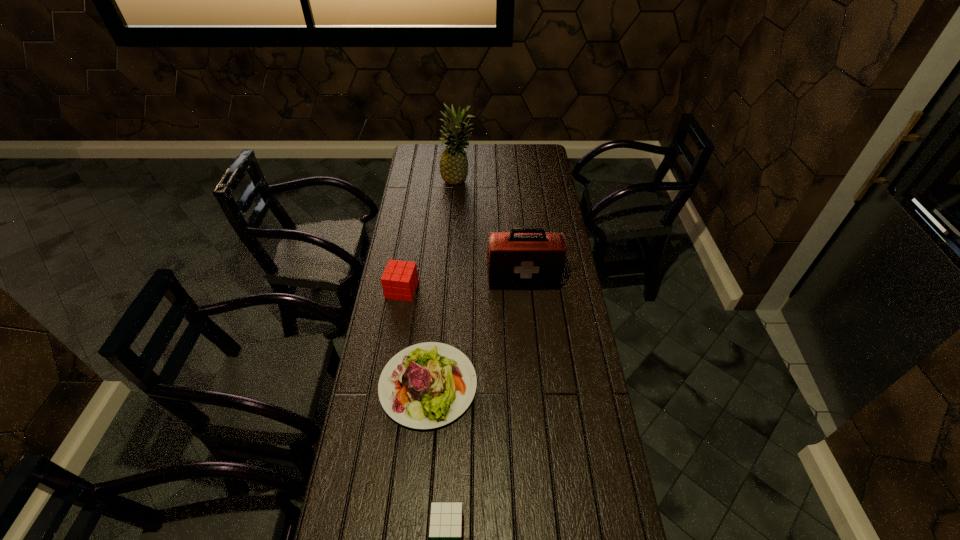
The height and width of the screenshot is (540, 960). In order to click on empty space between the second tallest object and the salad plate in this screenshot , I will do `click(476, 333)`.

Where is `empty space that is in between the first aid kit and the second nearest object`? This screenshot has width=960, height=540. empty space that is in between the first aid kit and the second nearest object is located at coordinates (476, 333).

You are a GUI agent. You are given a task and a screenshot of the screen. Output one action in this format:
    pyautogui.click(x=<x>, y=<y>)
    Task: Click on the unoccupied area between the left cube and the tallest object
    
    Given the screenshot: What is the action you would take?
    pyautogui.click(x=430, y=235)

What are the coordinates of `vacant point located between the pineapple and the rightmost object` in the screenshot? It's located at (491, 231).

Select which object appears as the fourth closest to the left cube. Please provide its 2D coordinates. Your answer should be formatted as a tuple, i.e. [(x, y)], where the tuple contains the x and y coordinates of a point satisfying the conditions above.

[(446, 519)]

Identify which object is the fourth nearest to the farthest object. Please provide its 2D coordinates. Your answer should be formatted as a tuple, i.e. [(x, y)], where the tuple contains the x and y coordinates of a point satisfying the conditions above.

[(446, 519)]

Locate an element on the screen. The height and width of the screenshot is (540, 960). free region that satisfies the following two spatial constraints: 1. on the back side of the farthest object; 2. on the right side of the salad plate is located at coordinates (447, 181).

Locate an element on the screen. vacant area in the image that satisfies the following two spatial constraints: 1. on the back side of the farther cube; 2. on the right side of the pineapple is located at coordinates coord(420,181).

The image size is (960, 540). I want to click on free space that satisfies the following two spatial constraints: 1. on the front side of the salad plate; 2. on the left side of the taller cube, so click(387, 386).